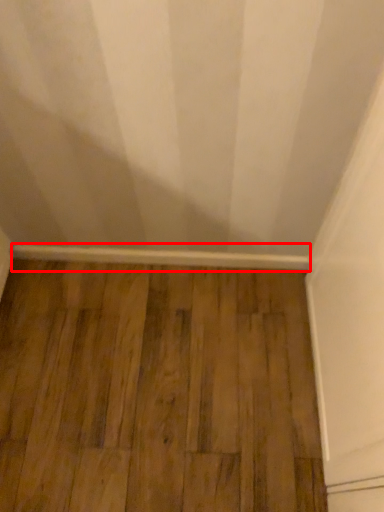
Question: In this image, where is molding (annotated by the red box) located relative to hardwood?

Choices:
 (A) right
 (B) left

Answer: (B)